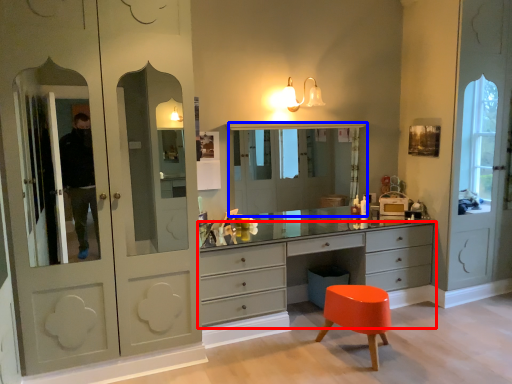
Question: Which object is further to the camera taking this photo, chest of drawers (highlighted by a red box) or medicine cabinet (highlighted by a blue box)?

Choices:
 (A) chest of drawers
 (B) medicine cabinet

Answer: (B)